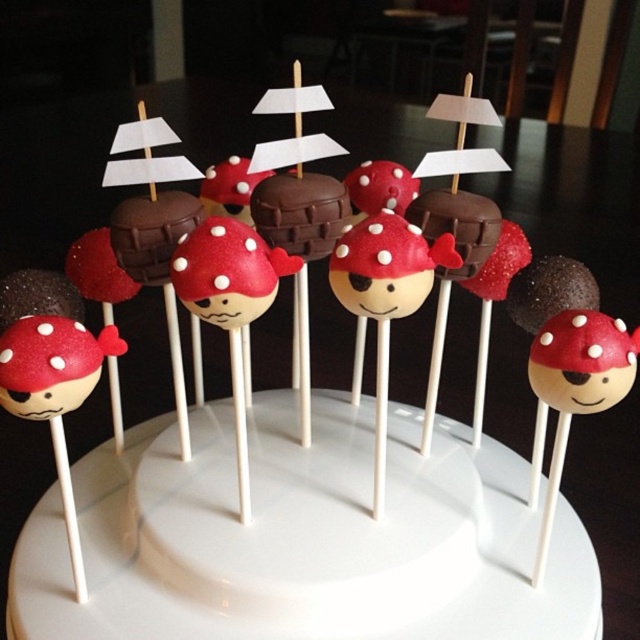
Question: From the image, what is the correct spatial relationship of matte chocolate cake pop at center in relation to chocolate matte cake pop at center?

Choices:
 (A) right
 (B) left

Answer: (A)

Question: Can you confirm if chocolate matte cake pop at center is positioned to the right of chocolate matte at center?

Choices:
 (A) yes
 (B) no

Answer: (A)

Question: Which of the following is the farthest from the observer?

Choices:
 (A) (269, 228)
 (B) (586, 348)

Answer: (A)

Question: Can you confirm if matte chocolate cake pop at center is positioned above chocolate matte at center?

Choices:
 (A) no
 (B) yes

Answer: (A)

Question: Estimate the real-world distances between objects in this image. Which object is farther from the chocolate matte cake pop at center?

Choices:
 (A) chocolate matte at center
 (B) matte chocolate cake pop at center

Answer: (B)

Question: Which point is closer to the camera?

Choices:
 (A) (572, 324)
 (B) (298, 212)

Answer: (A)